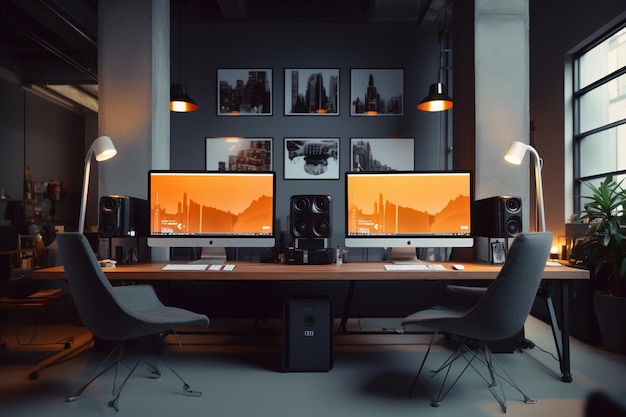
Identify the location of down lights. Image resolution: width=626 pixels, height=417 pixels. coord(429,104), coord(178,100).